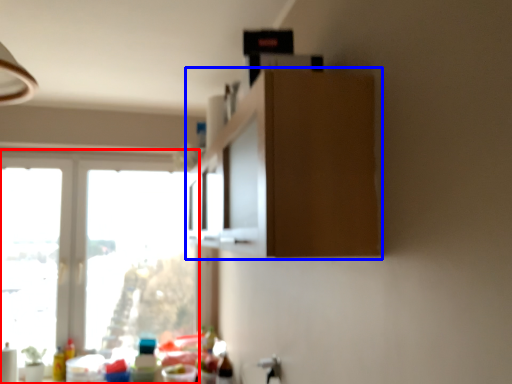
Question: Which object appears closest to the camera in this image, window (highlighted by a red box) or cabinetry (highlighted by a blue box)?

Choices:
 (A) window
 (B) cabinetry

Answer: (B)